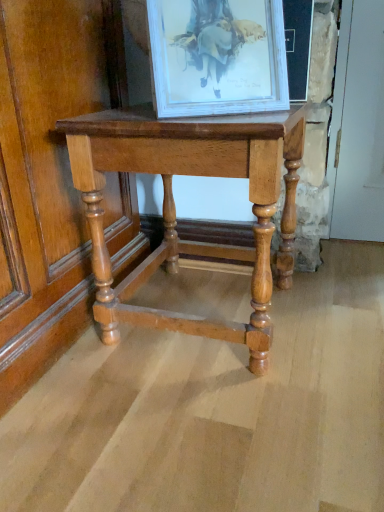
Where is `vacant space in front of white glossy picture frame at upper center`? This screenshot has width=384, height=512. vacant space in front of white glossy picture frame at upper center is located at coordinates (225, 121).